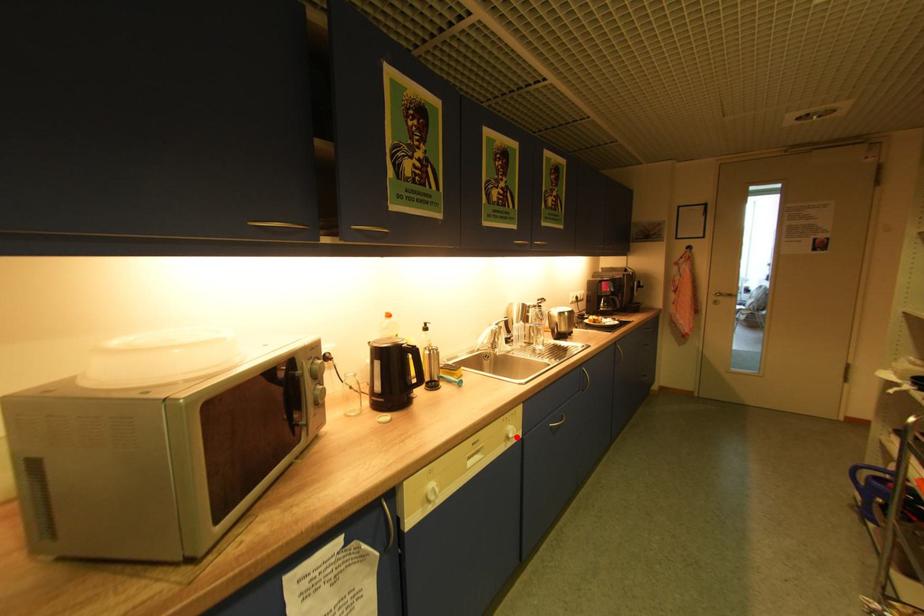
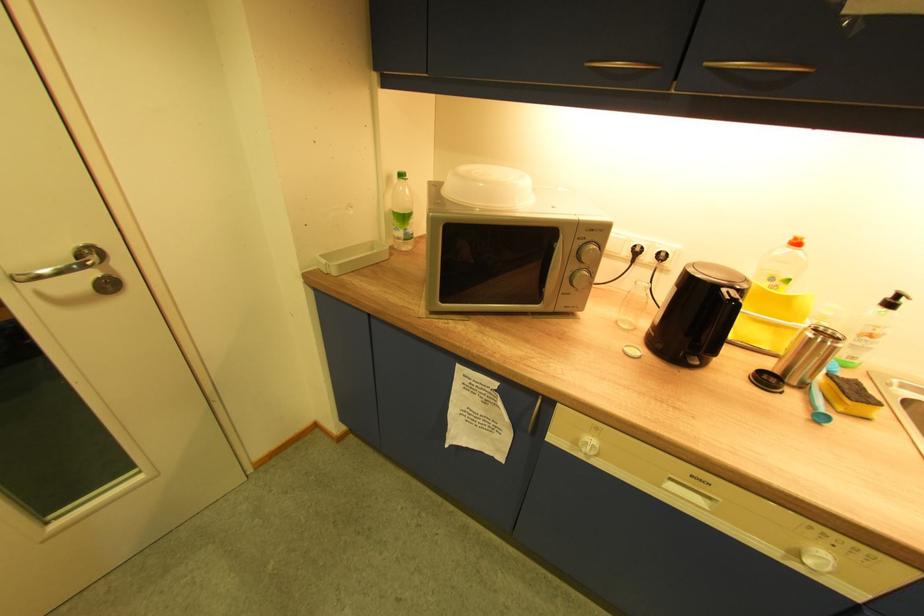
Locate, in the second image, the point that corresponds to the highlighted location in the first image.

(812, 562)